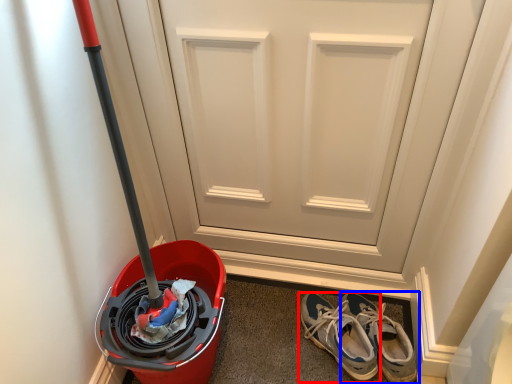
Question: Which object is closer to the camera taking this photo, footwear (highlighted by a red box) or footwear (highlighted by a blue box)?

Choices:
 (A) footwear
 (B) footwear

Answer: (A)